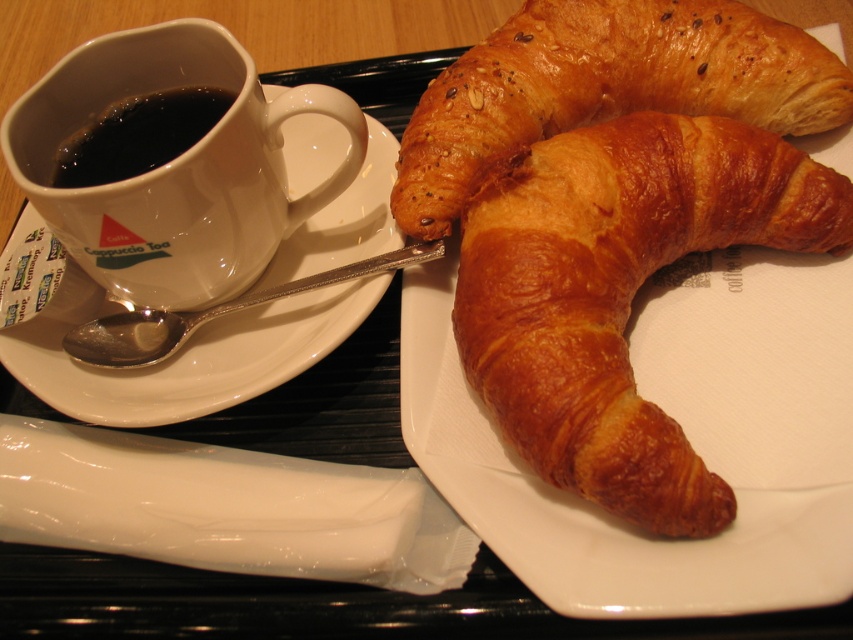
You are arranging a breakfast tray and need to place two croissants. The golden brown flaky croissant at center and the golden brown flaky croissant at upper right are already on the tray. If you want to add another croissant to the left of the one at upper right, where should you place it?

The golden brown flaky croissant at upper right is on the left side of the golden brown flaky croissant at center. To place a new croissant to the left of the one at upper right, you should position it to the left of the golden brown flaky croissant at upper right, which is already on the leftmost position between the two existing croissants.